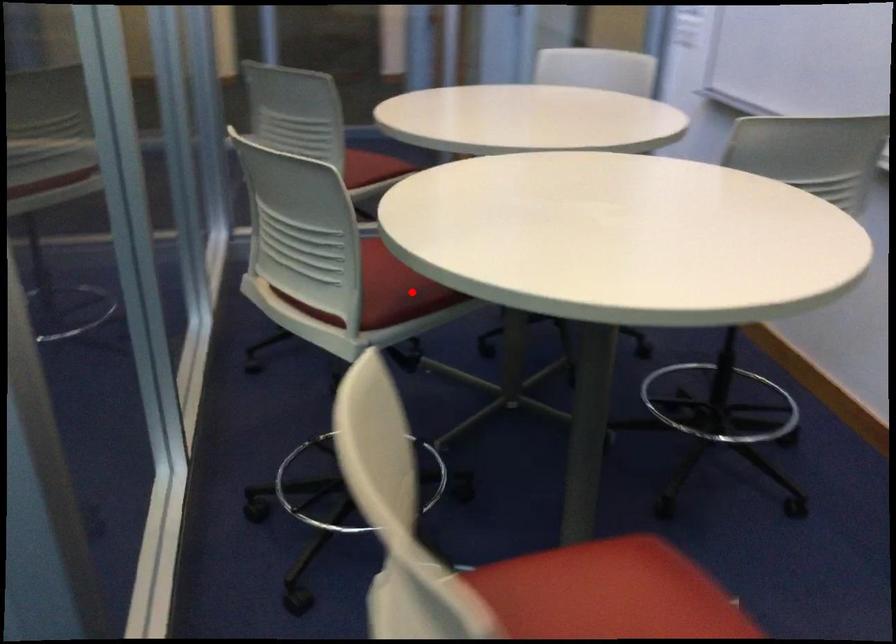
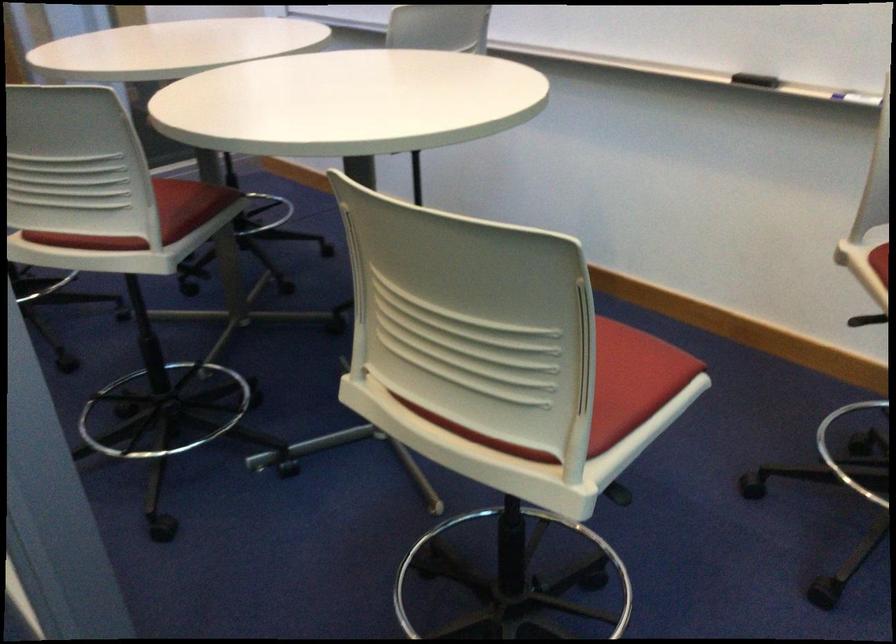
The point at the highlighted location is marked in the first image. Where is the corresponding point in the second image?

(187, 205)